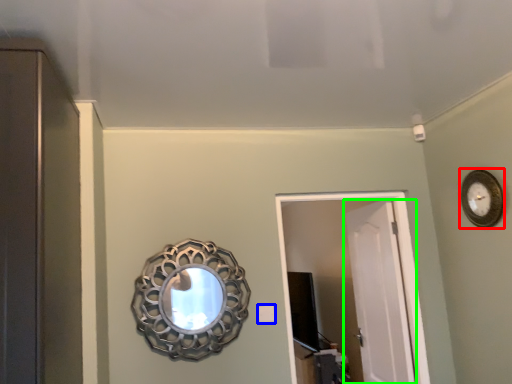
Question: Estimate the real-world distances between objects in this image. Which object is closer to clock (highlighted by a red box), light switch (highlighted by a blue box) or door (highlighted by a green box)?

Choices:
 (A) light switch
 (B) door

Answer: (B)